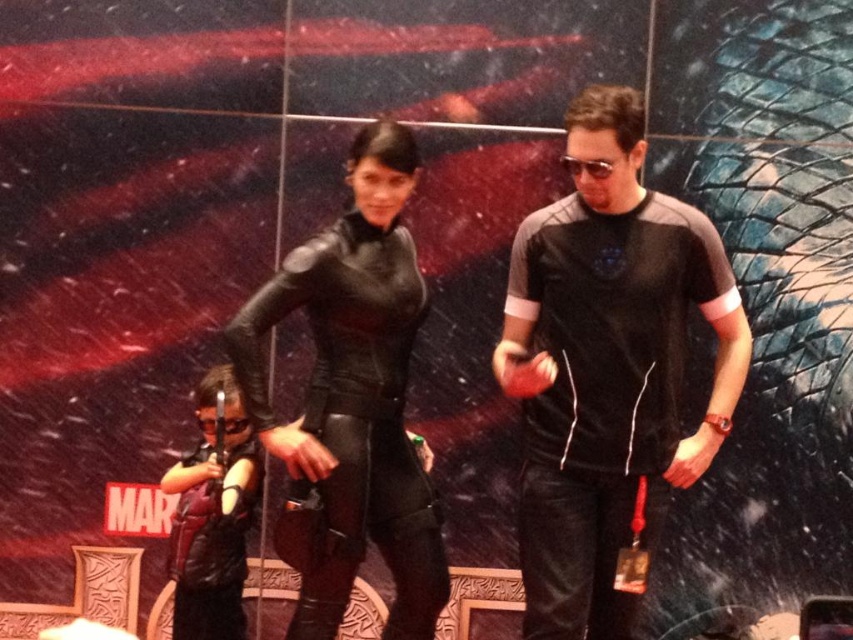
Question: Estimate the real-world distances between objects in this image. Which object is farther from the black fabric shirt at center?

Choices:
 (A) black leather wetsuit at center
 (B) black leather suit at center

Answer: (A)

Question: Can you confirm if black fabric shirt at center is wider than black leather suit at center?

Choices:
 (A) no
 (B) yes

Answer: (B)

Question: Does black fabric shirt at center appear under black leather suit at center?

Choices:
 (A) yes
 (B) no

Answer: (B)

Question: Which point appears closest to the camera in this image?

Choices:
 (A) (610, 614)
 (B) (256, 449)

Answer: (A)

Question: Which point is farther from the camera taking this photo?

Choices:
 (A) (503, 326)
 (B) (195, 584)
 (C) (350, 560)

Answer: (B)

Question: Is black fabric shirt at center positioned before black leather wetsuit at center?

Choices:
 (A) no
 (B) yes

Answer: (B)